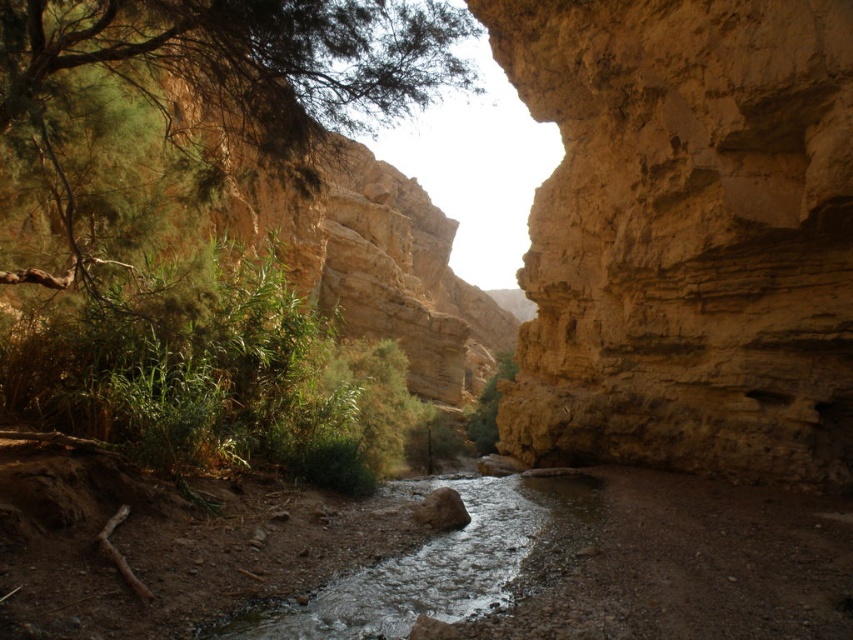
You are standing at the edge of the canyon and want to take a photo of both the matte yellow rock at center and the green leafy tree at upper left. Which object should you focus on first to ensure both are in the frame?

You should focus on the matte yellow rock at center first because it is taller than the green leafy tree at upper left, so adjusting the camera angle to include its height will naturally include the shorter tree in the frame.

You are standing at the point with coordinates point (428,3) and want to walk to the point with coordinates point (492,417). According to the scene description, which direction should you face to walk towards your destination?

You should face towards the back direction because point (428,3) is in front of point (492,417), so to reach the latter, you need to walk away from your current position towards the back.